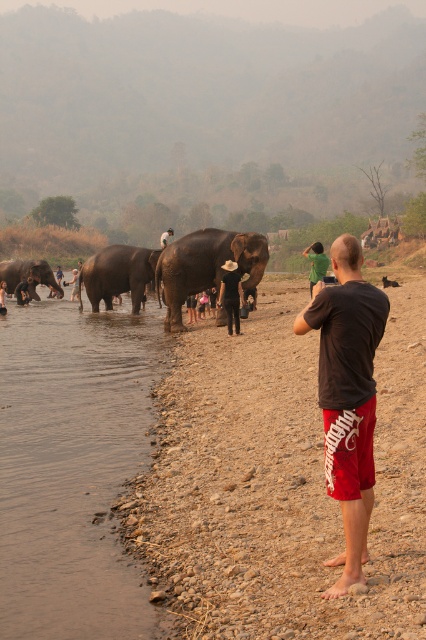
Question: Which point is farther to the camera?

Choices:
 (A) (80, 595)
 (B) (258, 236)
 (C) (8, 276)

Answer: (C)

Question: Is brown sedimentary river at lower left above black cotton t-shirt at right?

Choices:
 (A) yes
 (B) no

Answer: (B)

Question: Which object appears farthest from the camera in this image?

Choices:
 (A) gray matte elephant at left
 (B) dull brown gravel at lower right
 (C) brown sedimentary river at lower left
 (D) dark brown textured elephant at center

Answer: (A)

Question: Which is nearer to the gray matte elephant at left?

Choices:
 (A) black cotton t-shirt at right
 (B) brown sedimentary river at lower left

Answer: (B)

Question: Is grayish-brown textured elephant at center below gray matte elephant at left?

Choices:
 (A) no
 (B) yes

Answer: (B)

Question: Is brown sedimentary river at lower left further to the viewer compared to grayish-brown textured elephant at center?

Choices:
 (A) yes
 (B) no

Answer: (B)